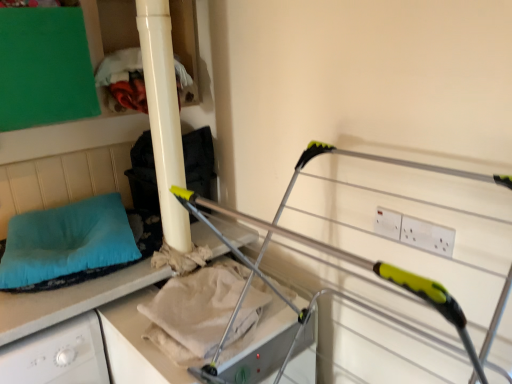
Question: From a real-world perspective, is teal fabric pillow at left physically located above or below beige cotton sheet at center?

Choices:
 (A) below
 (B) above

Answer: (B)

Question: Considering their positions, is teal fabric pillow at left located in front of or behind beige cotton sheet at center?

Choices:
 (A) front
 (B) behind

Answer: (B)

Question: Which is farther from the beige cotton sheet at center?

Choices:
 (A) metallic silver drying rack at center
 (B) matte white pillar at upper left
 (C) teal fabric pillow at left

Answer: (A)

Question: Estimate the real-world distances between objects in this image. Which object is farther from the beige cotton sheet at center?

Choices:
 (A) metallic silver drying rack at center
 (B) matte white pillar at upper left
 (C) teal fabric pillow at left

Answer: (A)